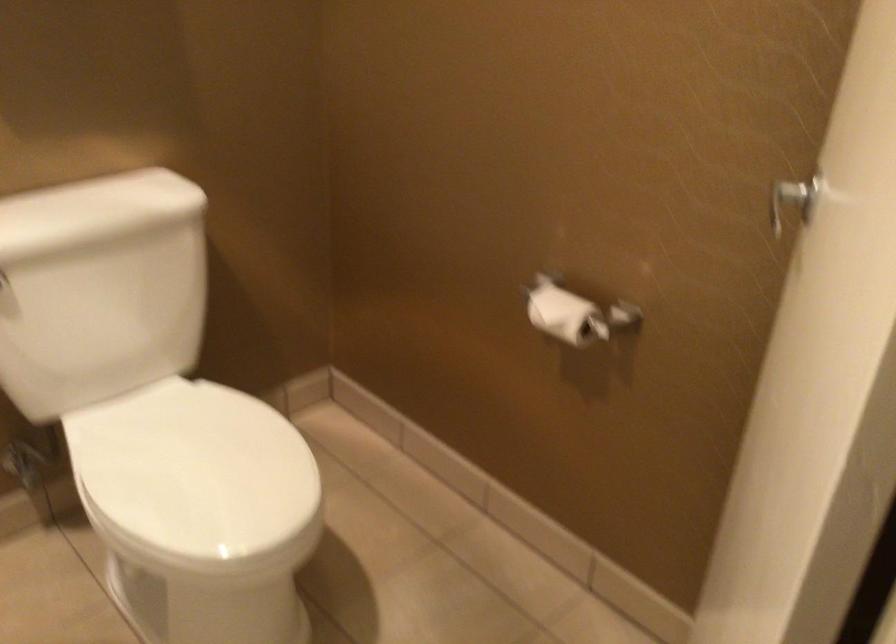
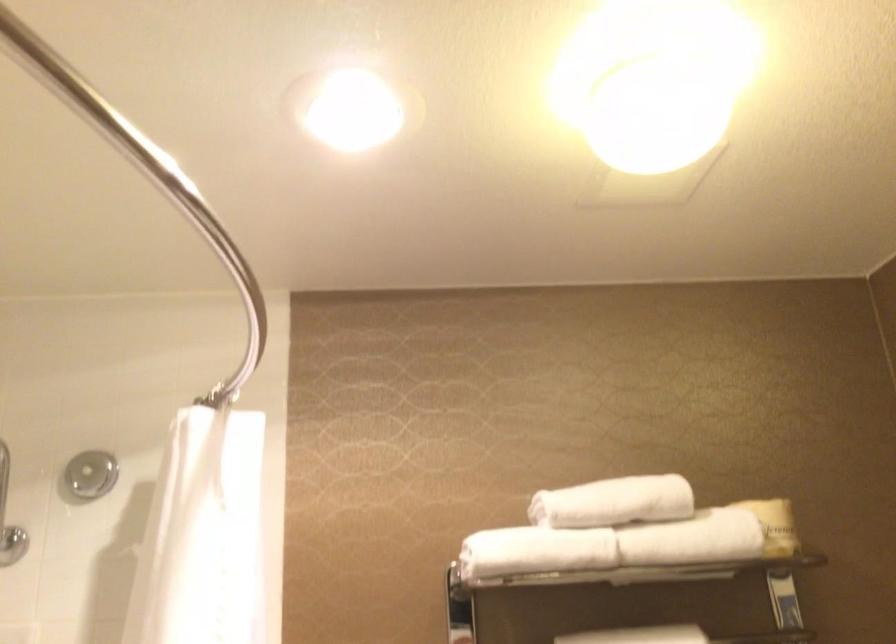
How did the camera likely rotate?

The rotation direction of the camera is left-up.